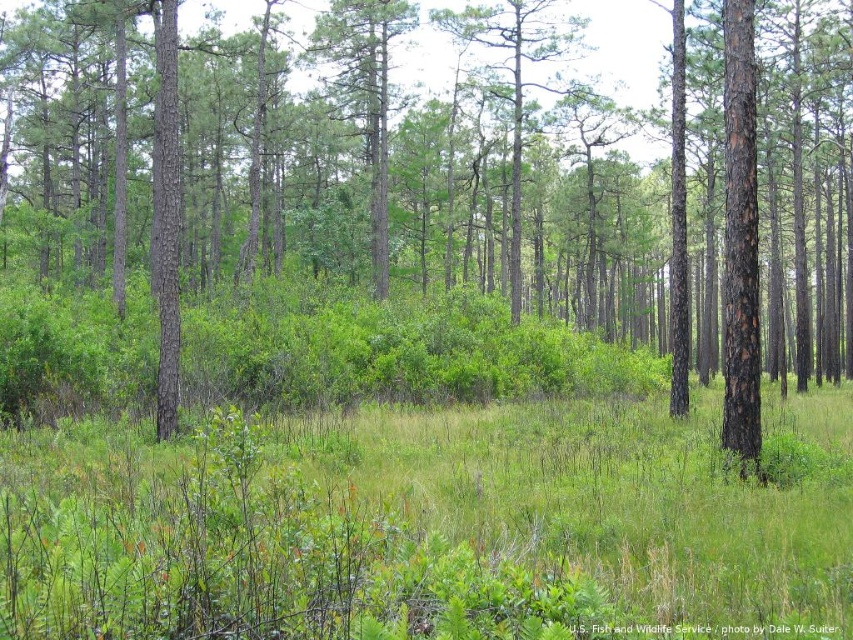
Is brown rough tree at center to the left of green grassy at center from the viewer's perspective?

Yes, brown rough tree at center is to the left of green grassy at center.

Between brown rough tree at center and green grassy at center, which one appears on the left side from the viewer's perspective?

Positioned to the left is brown rough tree at center.

Where is `brown rough tree at center`? This screenshot has height=640, width=853. brown rough tree at center is located at coordinates (448, 193).

At what (x,y) coordinates should I click in order to perform the action: click on brown rough tree at center. Please return your answer as a coordinate pair (x, y). The height and width of the screenshot is (640, 853). Looking at the image, I should click on (448, 193).